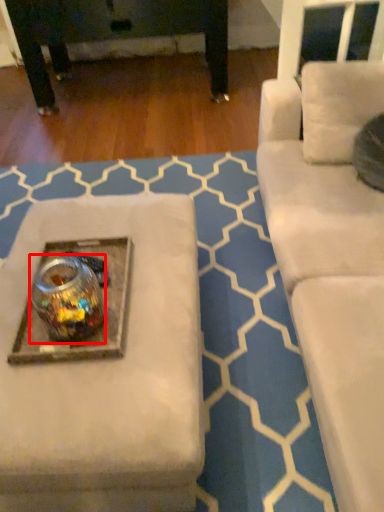
Question: Where is beverage (annotated by the red box) located in relation to round table in the image?

Choices:
 (A) left
 (B) right

Answer: (B)